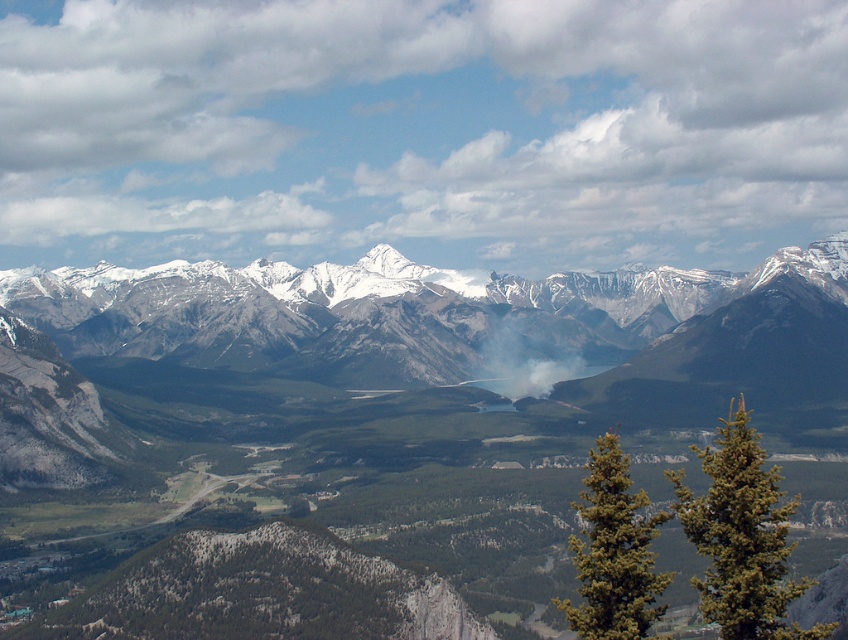
Who is lower down, green needle-like tree at lower right or white smoke at center?

Positioned lower is green needle-like tree at lower right.

Between green needle-like tree at lower right and white smoke at center, which one appears on the left side from the viewer's perspective?

white smoke at center

Between point (704, 572) and point (581, 372), which one is positioned behind?

The point (581, 372) is behind.

Identify the location of green needle-like tree at lower right. (742, 538).

Who is positioned more to the left, snowy granite mountains at center or green needle-like tree at lower right?

snowy granite mountains at center

Which is below, snowy granite mountains at center or green needle-like tree at lower right?

green needle-like tree at lower right

Describe the element at coordinates (388, 310) in the screenshot. I see `snowy granite mountains at center` at that location.

Image resolution: width=848 pixels, height=640 pixels. In order to click on snowy granite mountains at center in this screenshot , I will do `click(388, 310)`.

Can you confirm if snowy granite mountains at center is positioned to the left of green textured pine tree at right?

Correct, you'll find snowy granite mountains at center to the left of green textured pine tree at right.

Does snowy granite mountains at center have a lesser height compared to green textured pine tree at right?

In fact, snowy granite mountains at center may be taller than green textured pine tree at right.

Which is in front, point (625, 289) or point (600, 577)?

Point (600, 577)

Where is `snowy granite mountains at center`? The image size is (848, 640). snowy granite mountains at center is located at coordinates (388, 310).